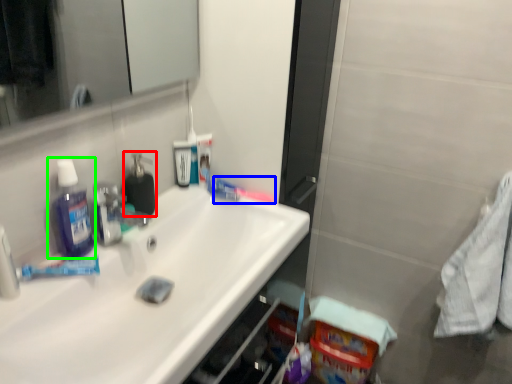
Question: Based on their relative distances, which object is nearer to soap dispenser (highlighted by a red box)? Choose from toothbrush (highlighted by a blue box) and mouthwash (highlighted by a green box).

Choices:
 (A) toothbrush
 (B) mouthwash

Answer: (B)